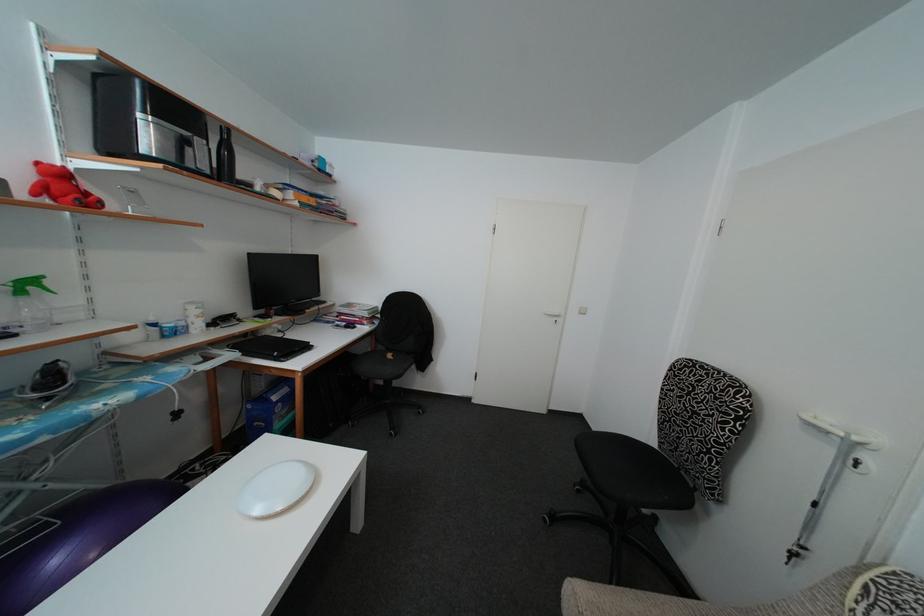
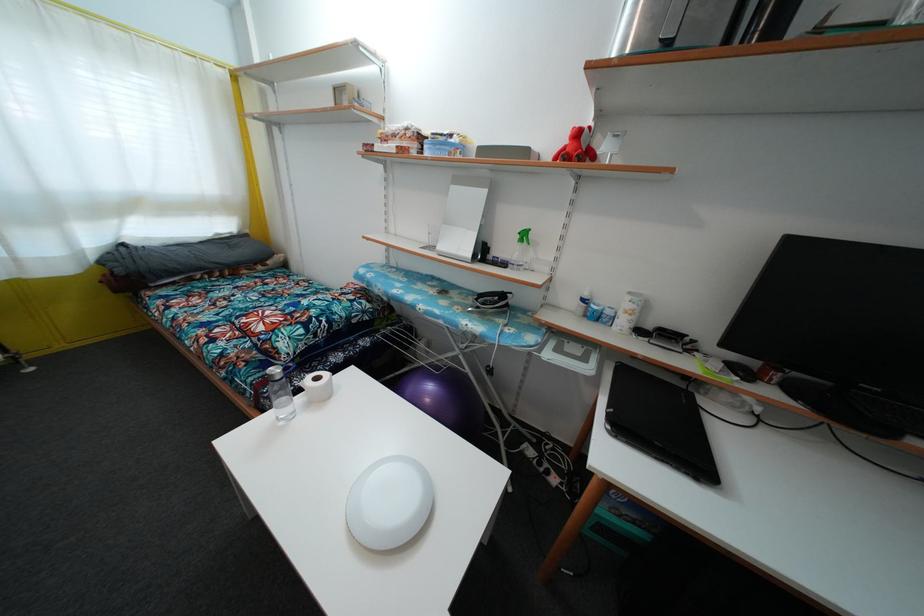
In the second image, find the point that corresponds to pixel 259 323 in the first image.

(728, 369)